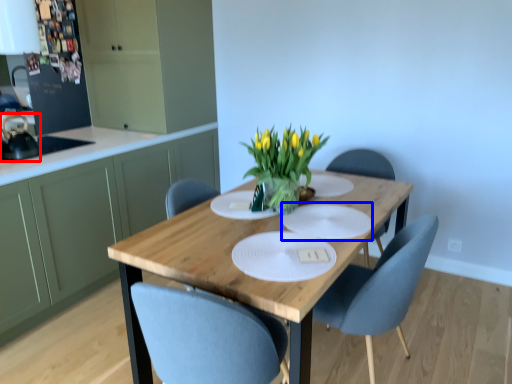
Question: Which of the following is the closest to the observer, appliance (highlighted by a red box) or glass plate (highlighted by a blue box)?

Choices:
 (A) appliance
 (B) glass plate

Answer: (B)